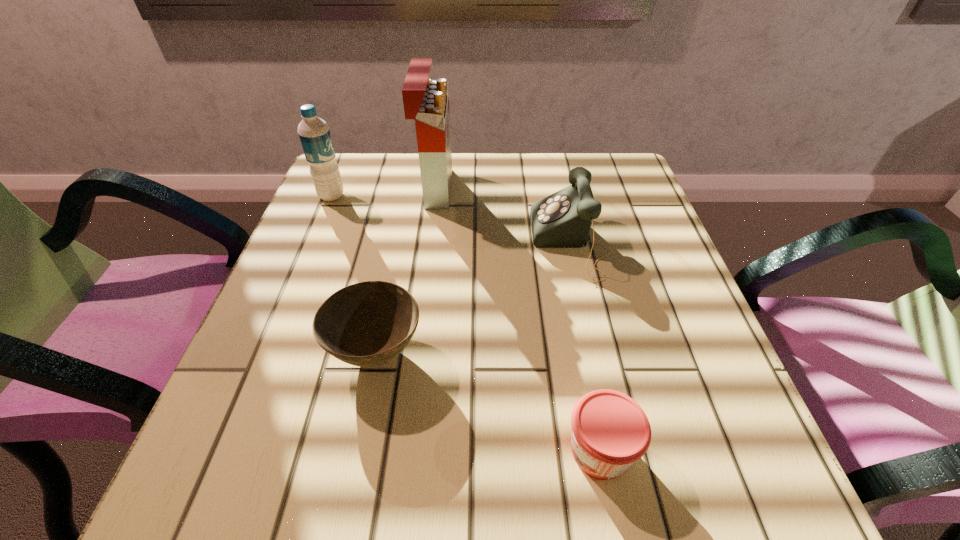
Locate an element on the screen. empty space that is in between the nearest object and the water bottle is located at coordinates (466, 323).

At what (x,y) coordinates should I click in order to perform the action: click on vacant point located between the jam and the third tallest object. Please return your answer as a coordinate pair (x, y). This screenshot has height=540, width=960. Looking at the image, I should click on (586, 347).

The image size is (960, 540). Identify the location of free space between the third shortest object and the cigarette case. (503, 215).

Locate an element on the screen. Image resolution: width=960 pixels, height=540 pixels. vacant area between the leftmost object and the bowl is located at coordinates (354, 274).

This screenshot has height=540, width=960. I want to click on vacant space that is in between the bowl and the tallest object, so click(406, 271).

The height and width of the screenshot is (540, 960). Identify the location of free space that is in between the bowl and the nearest object. (488, 401).

Identify the location of empty space that is in between the jam and the leftmost object. This screenshot has height=540, width=960. (466, 323).

This screenshot has height=540, width=960. Find the location of `free spot between the cigarette case and the second tallest object`. free spot between the cigarette case and the second tallest object is located at coordinates (383, 192).

Locate an element on the screen. object that is the second closest to the telephone is located at coordinates (367, 324).

Find the location of a particular element. object that is the fourth closest one to the second nearest object is located at coordinates (314, 133).